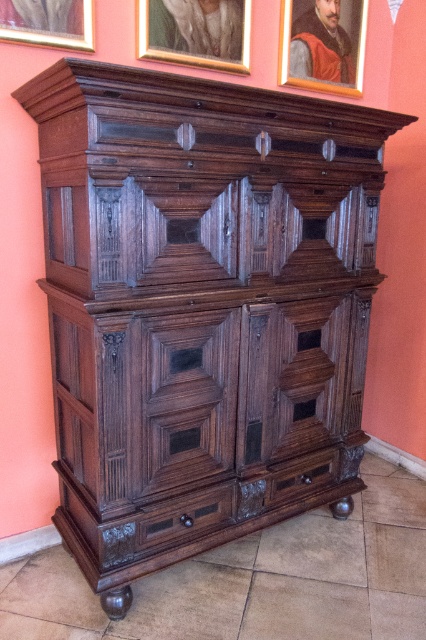
In the scene with the antique wooden cabinet against a pink wall, there are two picture frames on the cabinet. One is a goldmetallicpicture frame at upper center and the other is a brushed metal picture frame at upper left. Which one is positioned more to the right?

The goldmetallicpicture frame at upper center is positioned more to the right compared to the brushed metal picture frame at upper left.

In the scene shown: You are standing in front of the cabinet and want to place a small decorative item on the goldmetallicpicture frame at upper center. Can you confirm if the point at coordinates (195, 32) is located on the goldmetallicpicture frame at upper center?

Yes, the point at coordinates (195, 32) is located on the goldmetallicpicture frame at upper center.